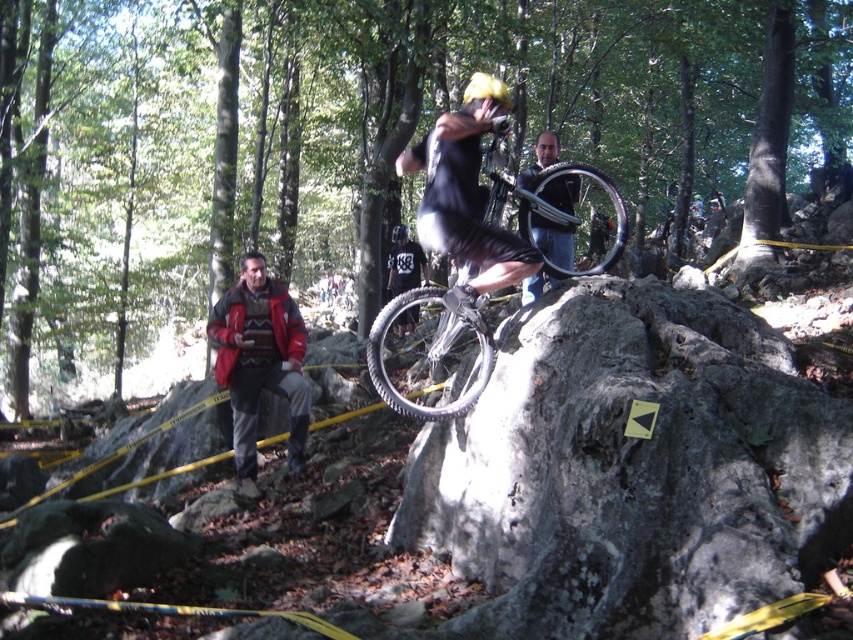
You are a photographer positioned at the camera location. You want to take a photo that includes both the point at coordinates point (404, 308) and point (527, 182). Since you want to ensure that both points are in focus, which point should you focus on to maximize the depth of field?

You should focus on point (527, 182) because it is farther from the camera than point (404, 308). Focusing on the farther point will ensure that both points are within the depth of field range.

From the picture: You are a photographer positioned at the edge of the forest, aiming to capture the cyclists during their jumps. You notice two cyclists wearing a black matte shirt at center and a dark gray jersey at center. Which cyclist should you focus on to ensure their full body fits within your camera frame, considering their sizes?

The black matte shirt at center has a larger width than the dark gray jersey at center, so focusing on the cyclist wearing the black matte shirt at center would ensure their full body fits within the camera frame due to their greater size.

You are a drone operator assigned to capture aerial footage of the mountain biking event. Your drone has a maximum range of 10 meters. You need to fly the drone from the black matte shirt at center to the dark gray jersey at center. Can the drone successfully complete this flight within its range?

The distance between the black matte shirt at center and the dark gray jersey at center is 9.95 meters, which is within the drone operator drone maximum range of 10 meters. Yes, the drone can successfully complete the flight between them.